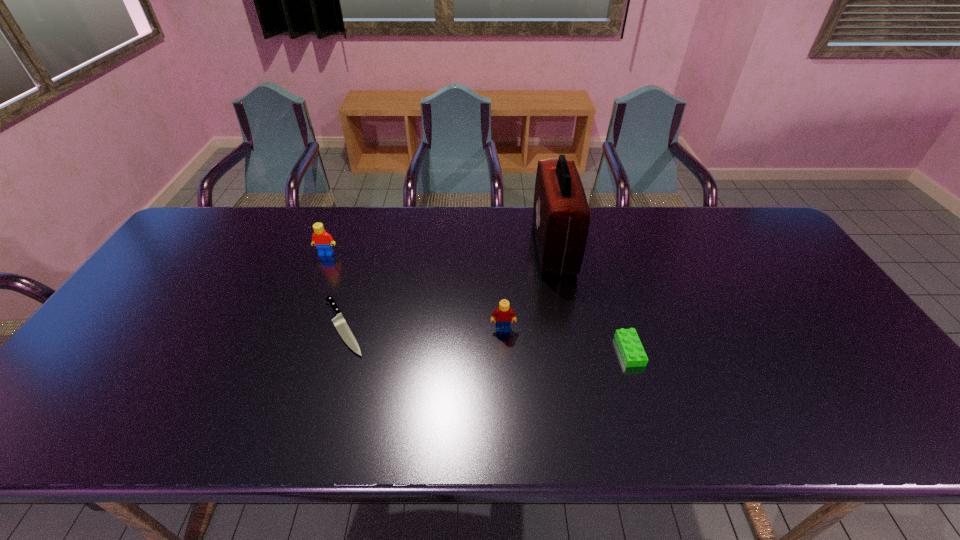
Locate an element on the screen. the first aid kit is located at coordinates pyautogui.click(x=561, y=215).

At what (x,y) coordinates should I click in order to perform the action: click on the fourth object from left to right. Please return your answer as a coordinate pair (x, y). Looking at the image, I should click on click(x=561, y=215).

At what (x,y) coordinates should I click in order to perform the action: click on the farthest Lego. Please return your answer as a coordinate pair (x, y). Looking at the image, I should click on point(323,241).

Identify the location of the leftmost Lego. The image size is (960, 540). (323, 241).

You are a GUI agent. You are given a task and a screenshot of the screen. Output one action in this format:
    pyautogui.click(x=<x>, y=<y>)
    Task: Click on the second nearest Lego
    This screenshot has width=960, height=540.
    Given the screenshot: What is the action you would take?
    pyautogui.click(x=503, y=315)

What are the coordinates of `the second Lego from left to right` in the screenshot? It's located at (503, 315).

Locate an element on the screen. This screenshot has width=960, height=540. the shortest Lego is located at coordinates (631, 349).

Where is `the rightmost object`? The height and width of the screenshot is (540, 960). the rightmost object is located at coordinates (631, 349).

I want to click on the fourth object from right to left, so [x=339, y=322].

I want to click on the shortest object, so click(339, 322).